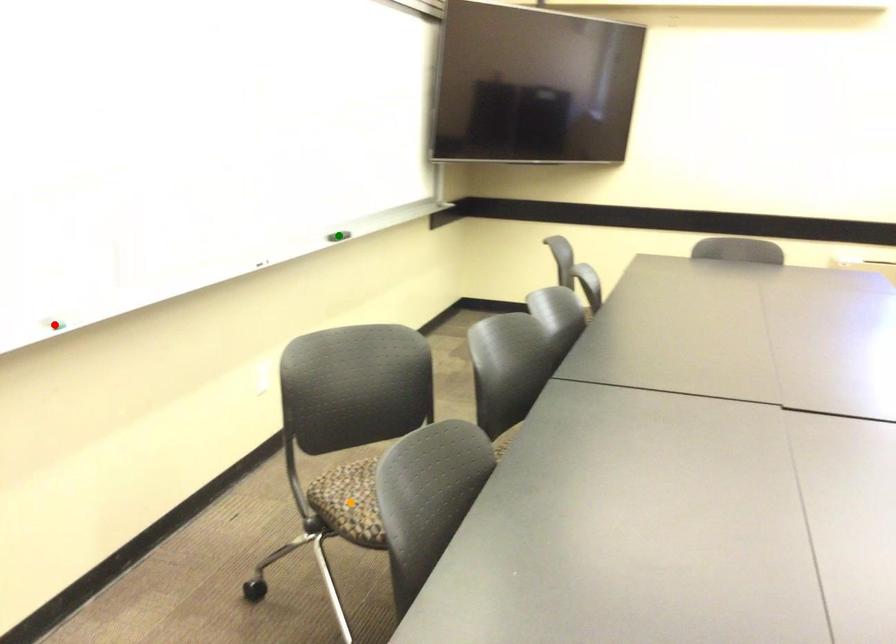
Order these from farthest to nearest:
green point
orange point
red point

green point, orange point, red point